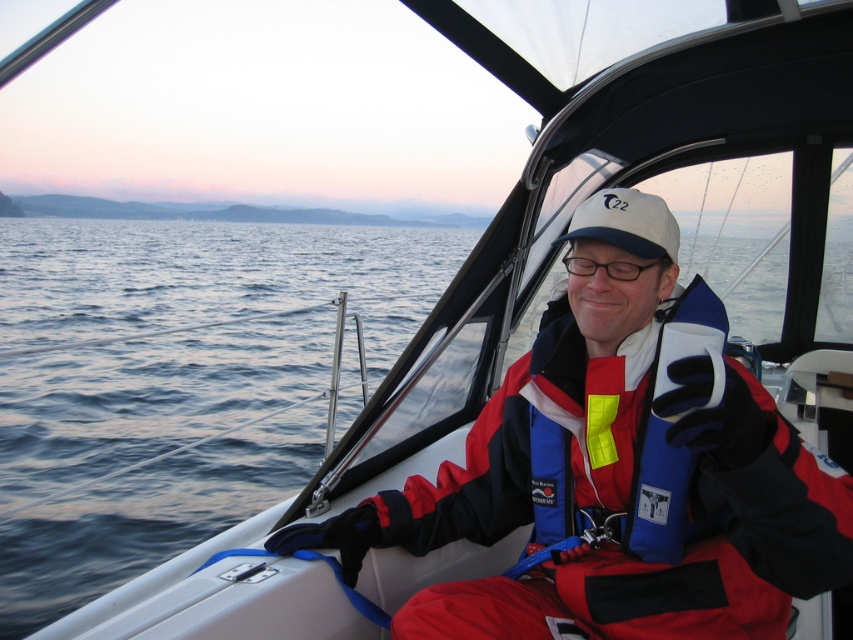
Looking at this image, between red fabric jacket at center and transparent plastic glasses at center, which one appears on the left side from the viewer's perspective?

From the viewer's perspective, red fabric jacket at center appears more on the left side.

Can you confirm if red fabric jacket at center is thinner than transparent plastic glasses at center?

No.

Between point (431, 628) and point (631, 280), which one is positioned behind?

Positioned behind is point (631, 280).

You are a GUI agent. You are given a task and a screenshot of the screen. Output one action in this format:
    pyautogui.click(x=<x>, y=<y>)
    Task: Click on the red fabric jacket at center
    
    Given the screenshot: What is the action you would take?
    pyautogui.click(x=614, y=474)